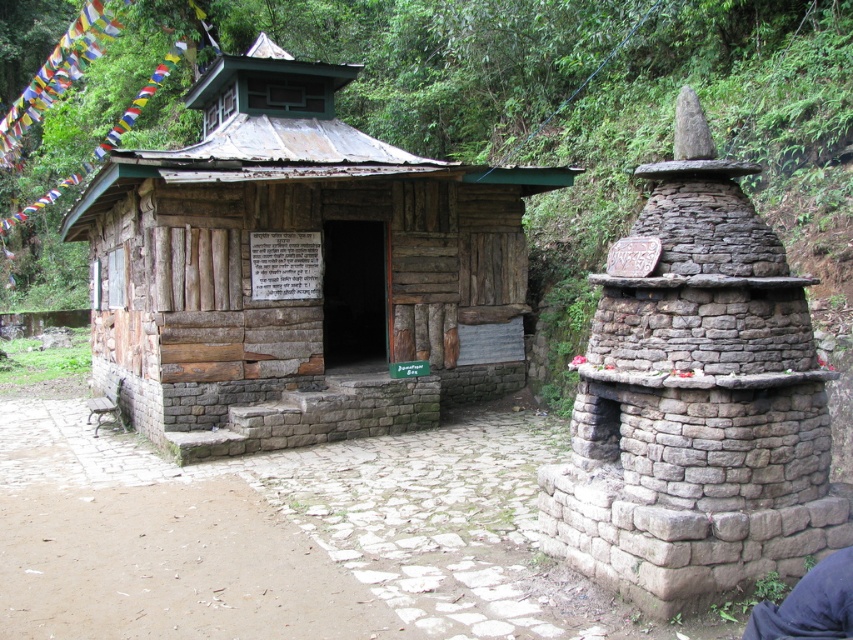
You are standing at the entrance of the rustic wooden hut at center. Looking towards the point marked at coordinates (299, 269), what direction would you be facing?

The point marked at coordinates (299, 269) corresponds to the rustic wooden hut at center itself, so facing that point would mean looking directly at the hut from its entrance.

You are planning to place a dark blue fabric at lower right near the rustic wooden hut at center. Considering their sizes, which object is wider?

The rustic wooden hut at center is wider than the dark blue fabric at lower right.